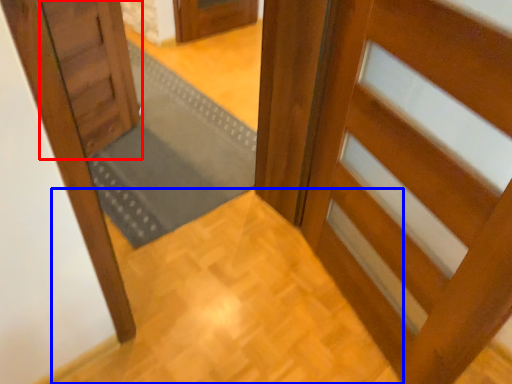
Question: Which object is closer to the camera taking this photo, door (highlighted by a red box) or path (highlighted by a blue box)?

Choices:
 (A) door
 (B) path

Answer: (B)